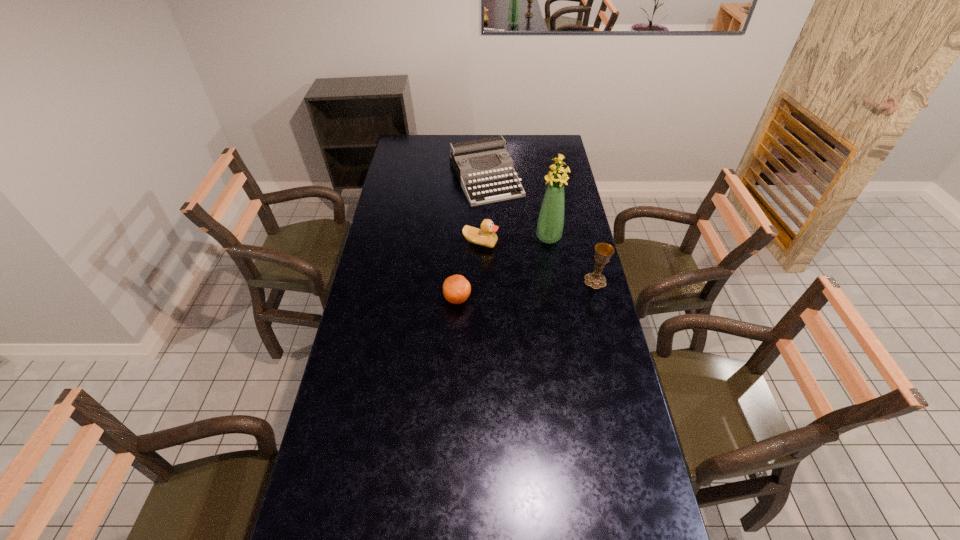
The height and width of the screenshot is (540, 960). Find the location of `vacant space on the desktop that is between the orange and the chalice and is positioned on the front-facing side of the fourth object from left to right`. vacant space on the desktop that is between the orange and the chalice and is positioned on the front-facing side of the fourth object from left to right is located at coordinates (512, 292).

You are a GUI agent. You are given a task and a screenshot of the screen. Output one action in this format:
    pyautogui.click(x=<x>, y=<y>)
    Task: Click on the vacant space on the desktop that is between the orange and the fourth shortest object and is positioned on the typing side of the farthest object
    This screenshot has height=540, width=960.
    Given the screenshot: What is the action you would take?
    pyautogui.click(x=547, y=287)

Find the location of a particular element. This screenshot has width=960, height=540. vacant spot on the desktop that is between the orange and the chalice and is positioned at the beak of the duck is located at coordinates (512, 292).